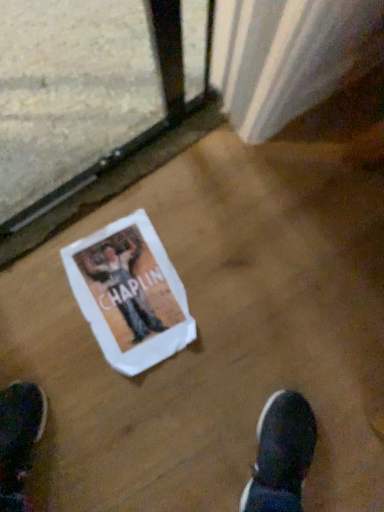
Locate an element on the screen. white paper flyer at center is located at coordinates (130, 294).

Describe the element at coordinates (130, 294) in the screenshot. This screenshot has height=512, width=384. I see `white paper flyer at center` at that location.

This screenshot has width=384, height=512. Describe the element at coordinates (90, 90) in the screenshot. I see `clear glass train window at lower left` at that location.

Identify the location of clear glass train window at lower left. (90, 90).

At what (x,y) coordinates should I click in order to perform the action: click on white paper flyer at center. Please return your answer as a coordinate pair (x, y). Looking at the image, I should click on (130, 294).

Does white paper flyer at center appear on the left side of clear glass train window at lower left?

In fact, white paper flyer at center is to the right of clear glass train window at lower left.

Between white paper flyer at center and clear glass train window at lower left, which one is positioned behind?

white paper flyer at center.

Is point (145, 329) positioned behind point (124, 51)?

No, (145, 329) is closer to viewer.

From the image's perspective, is white paper flyer at center positioned above or below clear glass train window at lower left?

white paper flyer at center is below clear glass train window at lower left.

From a real-world perspective, is white paper flyer at center positioned above or below clear glass train window at lower left?

white paper flyer at center is below clear glass train window at lower left.

Does white paper flyer at center have a greater width compared to clear glass train window at lower left?

Indeed, white paper flyer at center has a greater width compared to clear glass train window at lower left.

Which of these two, white paper flyer at center or clear glass train window at lower left, stands shorter?

With less height is white paper flyer at center.

Which of these two, white paper flyer at center or clear glass train window at lower left, is smaller?

With smaller size is white paper flyer at center.

Can we say white paper flyer at center lies outside clear glass train window at lower left?

Yes, white paper flyer at center is not within clear glass train window at lower left.

Is white paper flyer at center touching clear glass train window at lower left?

No, white paper flyer at center is not touching clear glass train window at lower left.

Is white paper flyer at center looking in the opposite direction of clear glass train window at lower left?

No, white paper flyer at center is not facing the opposite direction of clear glass train window at lower left.

How different are the orientations of white paper flyer at center and clear glass train window at lower left in degrees?

4.92 degrees separate the facing orientations of white paper flyer at center and clear glass train window at lower left.

Find the location of `train window lying above the white paper flyer at center (from the image's perspective)`. train window lying above the white paper flyer at center (from the image's perspective) is located at coordinates (90, 90).

Does clear glass train window at lower left appear on the left side of white paper flyer at center?

Correct, you'll find clear glass train window at lower left to the left of white paper flyer at center.

Considering the relative positions of clear glass train window at lower left and white paper flyer at center in the image provided, is clear glass train window at lower left behind white paper flyer at center?

No, clear glass train window at lower left is closer to the camera.

Is point (102, 72) behind point (114, 247)?

Yes, it is behind point (114, 247).

From the image's perspective, would you say clear glass train window at lower left is shown under white paper flyer at center?

Actually, clear glass train window at lower left appears above white paper flyer at center in the image.

From a real-world perspective, is clear glass train window at lower left positioned above or below white paper flyer at center?

Clearly, from a real-world perspective, clear glass train window at lower left is above white paper flyer at center.

Does clear glass train window at lower left have a lesser width compared to white paper flyer at center?

Yes, clear glass train window at lower left is thinner than white paper flyer at center.

Is clear glass train window at lower left taller than white paper flyer at center?

Indeed, clear glass train window at lower left has a greater height compared to white paper flyer at center.

Considering the sizes of objects clear glass train window at lower left and white paper flyer at center in the image provided, who is smaller, clear glass train window at lower left or white paper flyer at center?

With smaller size is white paper flyer at center.

Can we say clear glass train window at lower left lies outside white paper flyer at center?

clear glass train window at lower left lies outside white paper flyer at center's area.

Is clear glass train window at lower left far from white paper flyer at center?

No.

Does clear glass train window at lower left turn towards white paper flyer at center?

No, clear glass train window at lower left is not turned towards white paper flyer at center.

How different are the orientations of clear glass train window at lower left and white paper flyer at center in degrees?

They differ by 4.92 degrees in their facing directions.

Locate an element on the screen. train window above the white paper flyer at center (from a real-world perspective) is located at coordinates (90, 90).

I want to click on train window in front of the white paper flyer at center, so click(90, 90).

Where is `train window above the white paper flyer at center (from the image's perspective)`? The image size is (384, 512). train window above the white paper flyer at center (from the image's perspective) is located at coordinates (90, 90).